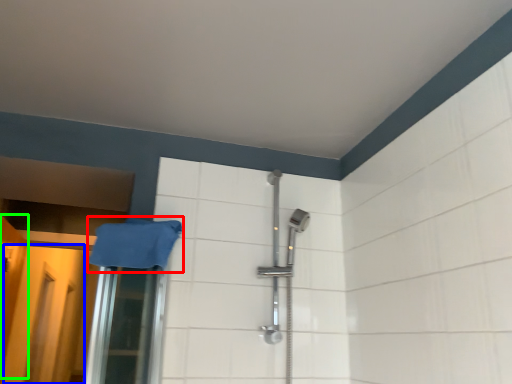
Question: Estimate the real-world distances between objects in this image. Which object is closer to bath towel (highlighted by a red box), screen door (highlighted by a blue box) or door (highlighted by a green box)?

Choices:
 (A) screen door
 (B) door

Answer: (A)